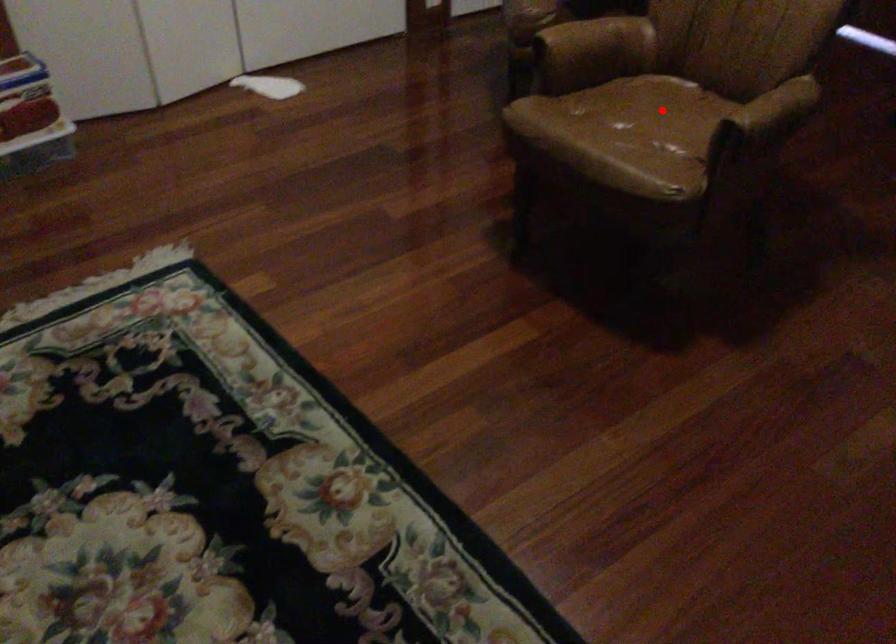
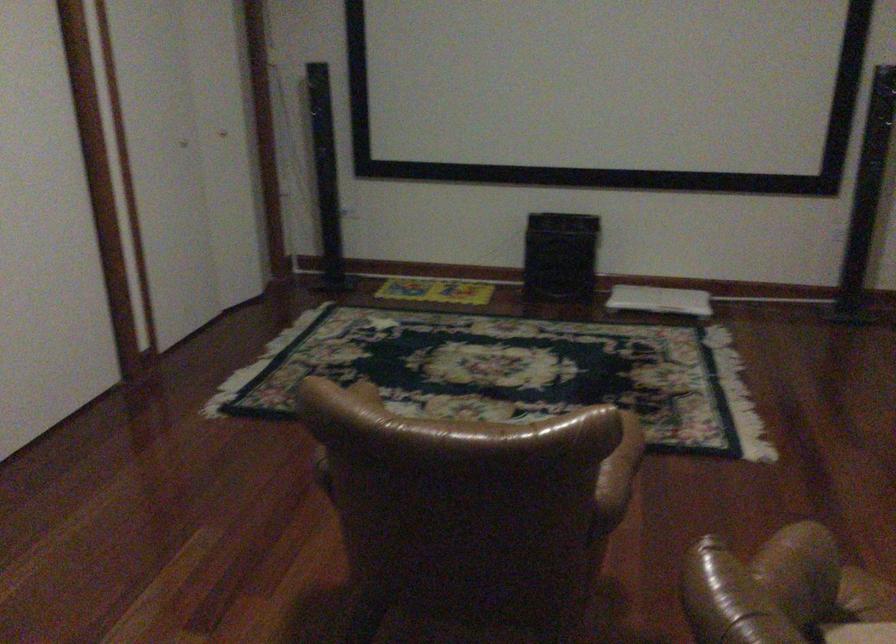
Question: I am providing you with two images of the same scene from different viewpoints. A red point is marked on the first image. At the location where the point appears in image 1, is it still visible in image 2?

Choices:
 (A) Yes
 (B) No

Answer: (B)